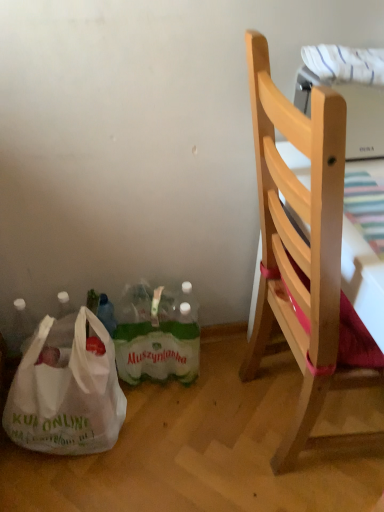
This screenshot has height=512, width=384. Identify the location of free space to the right of green plastic bottles at lower center. (223, 387).